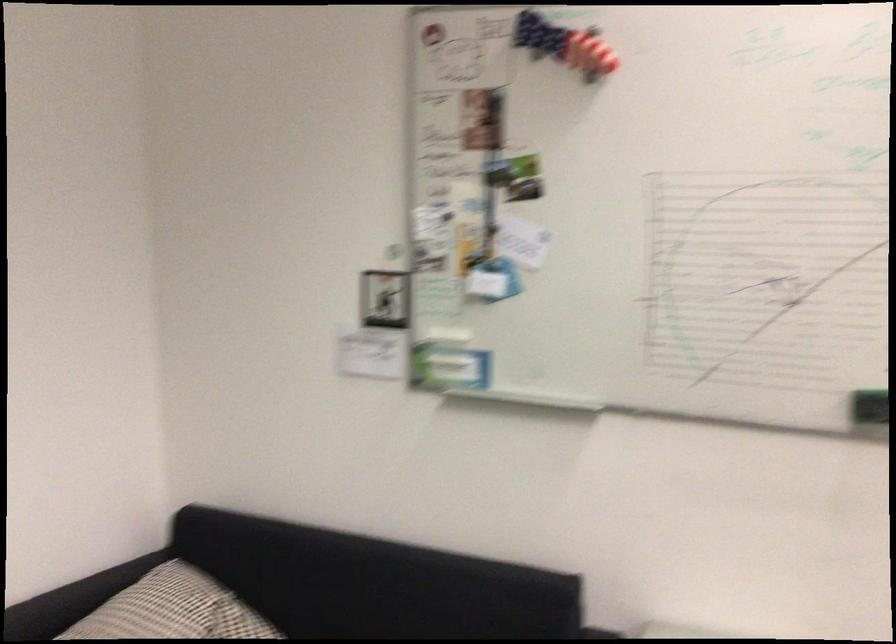
Where would you wip the whiteboard eraser? Please return your answer as a coordinate pair (x, y).

(869, 406)